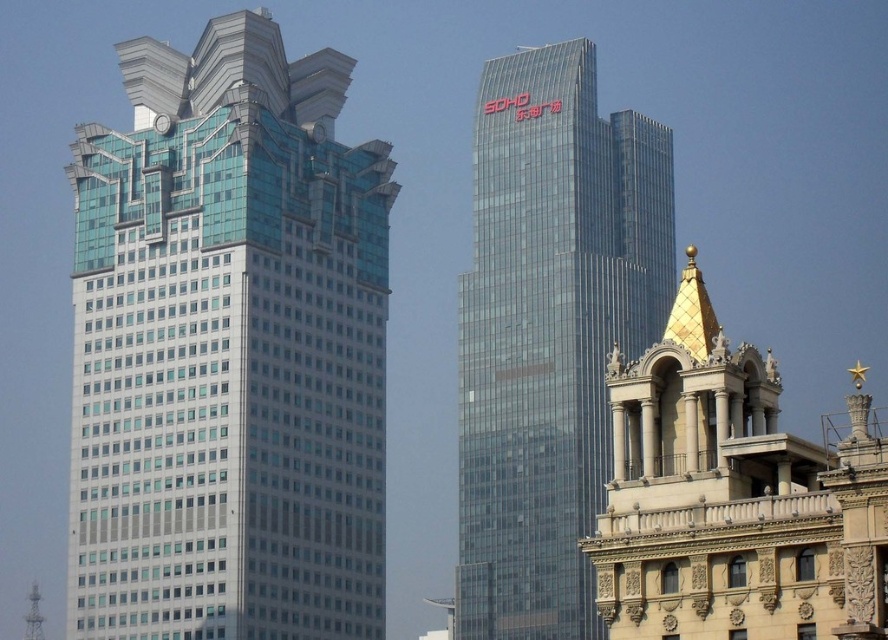
Does glassy steel skyscraper at left come behind transparent glass tower at center?

No.

Who is lower down, glassy steel skyscraper at left or transparent glass tower at center?

glassy steel skyscraper at left

Is point (359, 532) closer to viewer compared to point (577, 56)?

Yes, point (359, 532) is in front of point (577, 56).

Where is `glassy steel skyscraper at left`? glassy steel skyscraper at left is located at coordinates (228, 349).